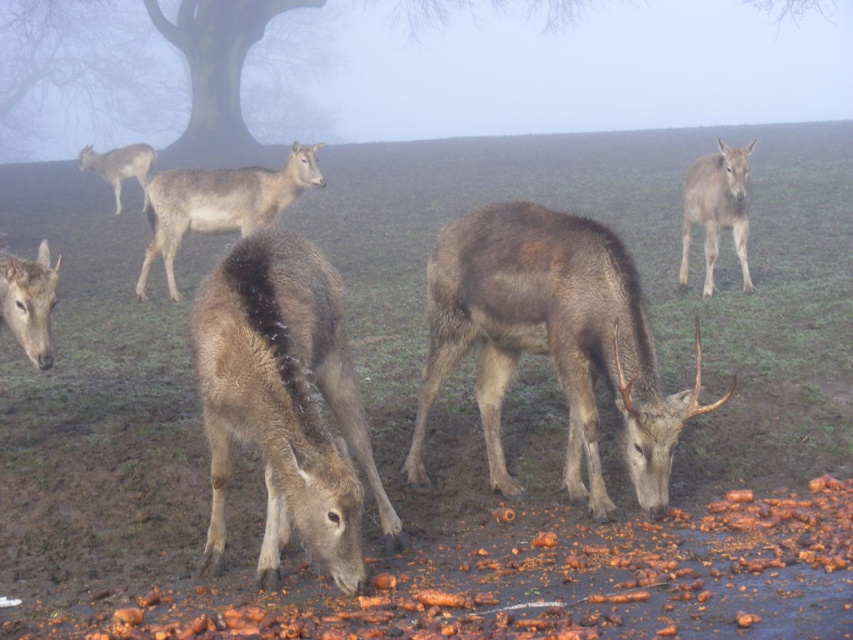
Question: Is brown fur deer at center smaller than brown furry deer at center?

Choices:
 (A) yes
 (B) no

Answer: (B)

Question: Is brown fur deer at lower left smaller than gray fur deer at upper left?

Choices:
 (A) no
 (B) yes

Answer: (B)

Question: Which of these objects is positioned closest to the gray matte deer at center?

Choices:
 (A) gray fur deer at upper right
 (B) brown fur deer at center
 (C) brown fur deer at lower left
 (D) gray fur deer at upper left

Answer: (D)

Question: Which object appears closest to the camera in this image?

Choices:
 (A) gray fur deer at upper left
 (B) brown furry deer at center

Answer: (B)

Question: In this image, where is brown furry deer at center located relative to brown fur deer at lower left?

Choices:
 (A) below
 (B) above

Answer: (A)

Question: Which of the following is the closest to the observer?

Choices:
 (A) gray fur deer at upper right
 (B) gray matte deer at center

Answer: (A)